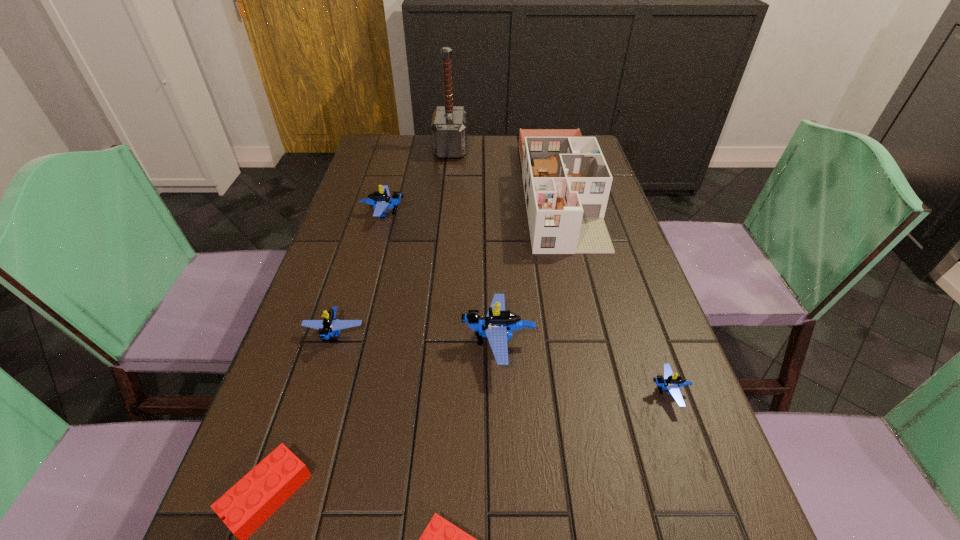
Find the location of a particular element. The width and height of the screenshot is (960, 540). brown hammer is located at coordinates (449, 123).

I want to click on the tallest object, so click(x=449, y=123).

At what (x,y) coordinates should I click in order to perform the action: click on dollhouse. Please return your answer as a coordinate pair (x, y). The width and height of the screenshot is (960, 540). Looking at the image, I should click on (566, 180).

Find the location of `the tallest Lego`. the tallest Lego is located at coordinates (497, 326).

The height and width of the screenshot is (540, 960). Identify the location of the third blue Lego from left to right. (497, 326).

What are the coordinates of `the second tallest Lego` in the screenshot? It's located at (381, 199).

Find the location of a particular element. The height and width of the screenshot is (540, 960). the farthest Lego is located at coordinates (381, 199).

Locate an element on the screen. The image size is (960, 540). the fifth tallest object is located at coordinates (329, 325).

Locate an element on the screen. The width and height of the screenshot is (960, 540). the third tallest Lego is located at coordinates [329, 325].

Locate an element on the screen. This screenshot has width=960, height=540. the fourth tallest Lego is located at coordinates (670, 382).